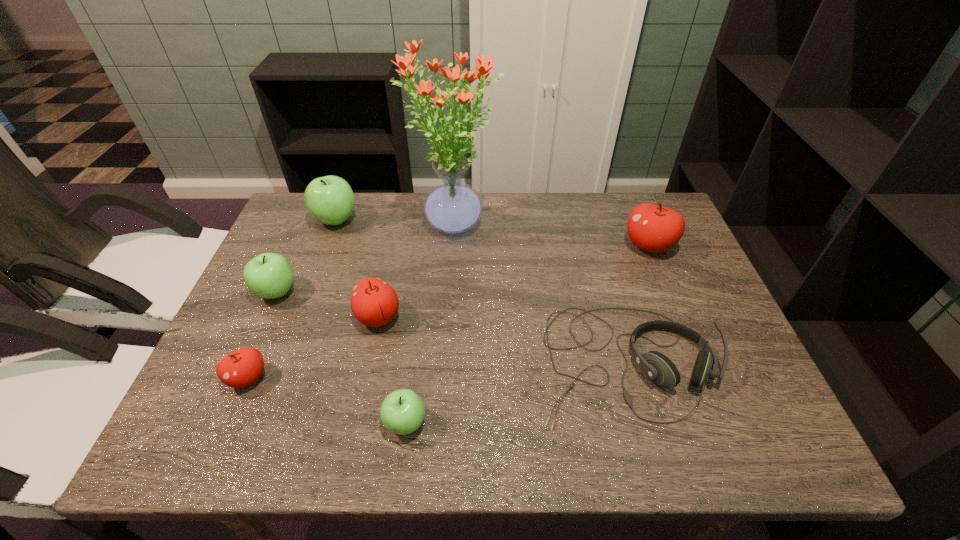
Identify the location of vacant point at the left edge. Image resolution: width=960 pixels, height=540 pixels. (257, 342).

Identify the location of free space at the right edge. (714, 309).

Where is `vacant area at the near left corner`? The height and width of the screenshot is (540, 960). vacant area at the near left corner is located at coordinates (181, 452).

The image size is (960, 540). In the image, there is a desktop. Find the location of `vacant space at the far right corner`. vacant space at the far right corner is located at coordinates (663, 202).

In the image, there is a desktop. Where is `vacant space at the near right corner`? The width and height of the screenshot is (960, 540). vacant space at the near right corner is located at coordinates (710, 424).

The height and width of the screenshot is (540, 960). I want to click on vacant space that's between the nearest apple and the rightmost red apple, so click(527, 334).

Locate an element on the screen. vacant region between the second nearest apple and the smallest green apple is located at coordinates (326, 401).

Find the location of a particular element. The image size is (960, 540). vacant area that lies between the leftmost red apple and the headset is located at coordinates (437, 370).

Locate an element on the screen. This screenshot has width=960, height=540. vacant space that's between the second smallest green apple and the tallest object is located at coordinates (366, 260).

In order to click on vacant area between the leftmost red apple and the second nearest red apple in this screenshot , I will do `click(313, 348)`.